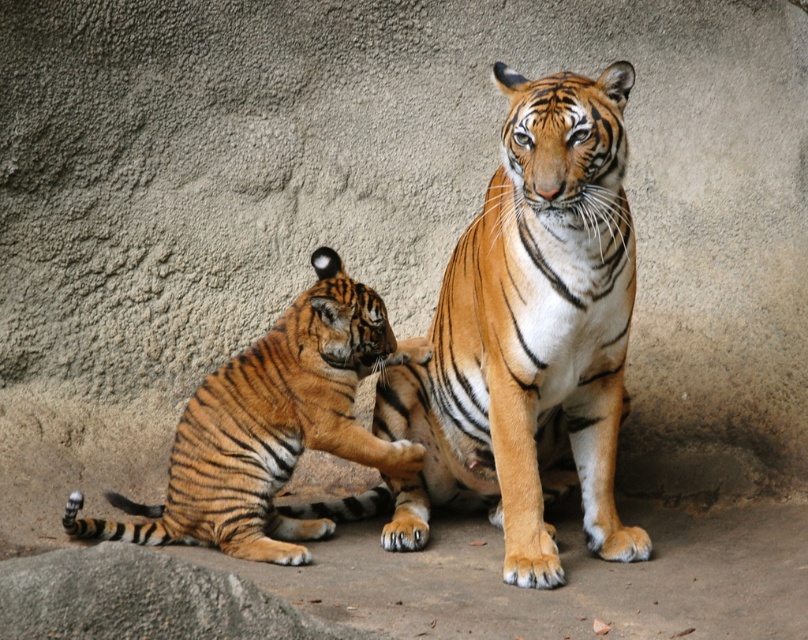
Question: Does orange striped tiger at center have a larger size compared to orange striped tiger at lower left?

Choices:
 (A) no
 (B) yes

Answer: (B)

Question: Can you confirm if orange striped tiger at center is positioned to the left of orange striped tiger at lower left?

Choices:
 (A) yes
 (B) no

Answer: (B)

Question: Can you confirm if orange striped tiger at center is wider than orange striped tiger at lower left?

Choices:
 (A) yes
 (B) no

Answer: (B)

Question: Among these objects, which one is farthest from the camera?

Choices:
 (A) orange striped tiger at lower left
 (B) orange striped tiger at center

Answer: (A)

Question: Which object appears closest to the camera in this image?

Choices:
 (A) orange striped tiger at center
 (B) orange striped tiger at lower left

Answer: (A)

Question: Which of the following is the farthest from the observer?

Choices:
 (A) orange striped tiger at lower left
 (B) orange striped tiger at center

Answer: (A)